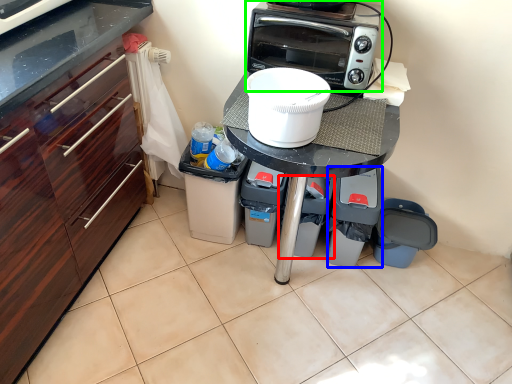
Question: Which object is positioned closest to appliance (highlighted by a red box)? Select from appliance (highlighted by a blue box) and kitchen appliance (highlighted by a green box).

Choices:
 (A) appliance
 (B) kitchen appliance

Answer: (A)